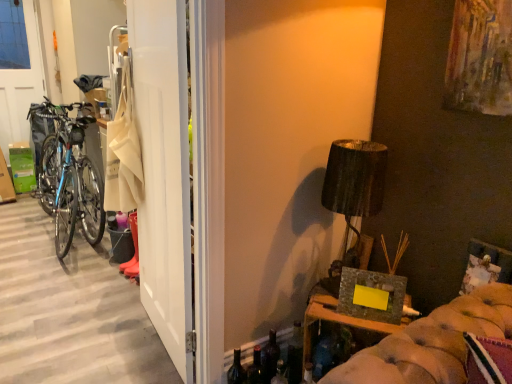
Find the location of a particular element. vacant area that is in front of white matte door at left is located at coordinates (143, 361).